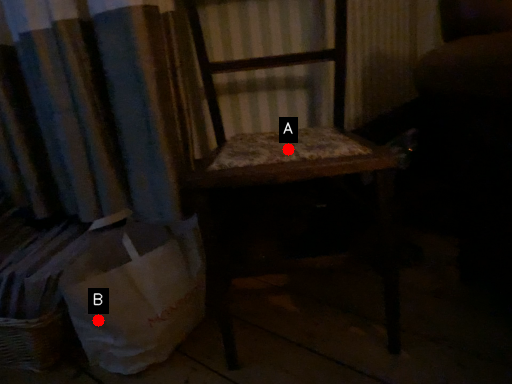
Question: Two points are circled on the image, labeled by A and B beside each circle. Which point is closer to the camera?

Choices:
 (A) A is closer
 (B) B is closer

Answer: (B)